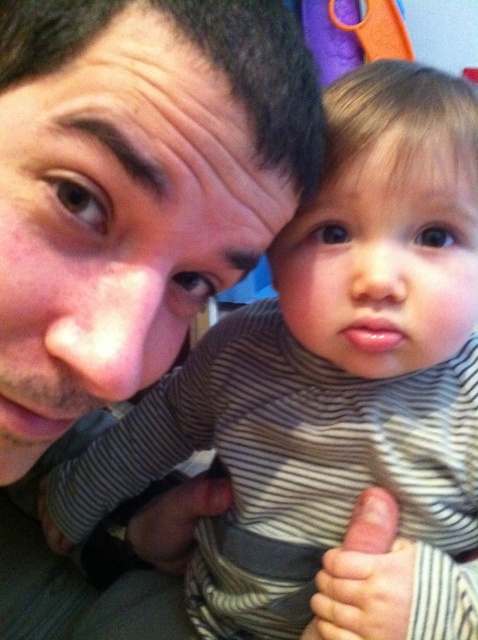
Does matte skin face at upper left appear on the left side of matte gray thumb at center?

Yes, matte skin face at upper left is to the left of matte gray thumb at center.

In the scene shown: Does matte skin face at upper left appear over matte gray thumb at center?

Correct, matte skin face at upper left is located above matte gray thumb at center.

Which is behind, point (195, 156) or point (365, 552)?

The point (365, 552) is more distant.

The height and width of the screenshot is (640, 478). Find the location of `matte skin face at upper left`. matte skin face at upper left is located at coordinates (133, 188).